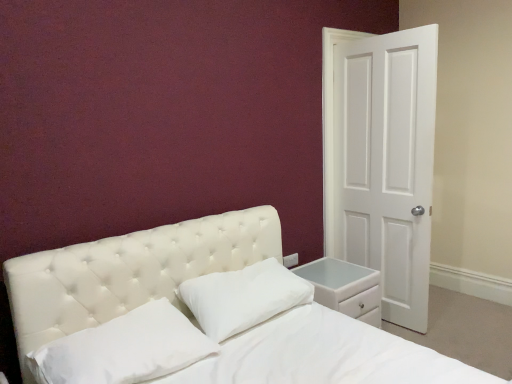
Question: Would you say white soft pillow at center, which is the 2th pillow from left to right, is to the left or to the right of white matte door at right in the picture?

Choices:
 (A) right
 (B) left

Answer: (B)

Question: Is white soft pillow at center, which is the 2th pillow from left to right, inside or outside of white matte door at right?

Choices:
 (A) outside
 (B) inside

Answer: (A)

Question: Which of these objects is positioned farthest from the white soft pillow at center, the 1th pillow positioned from the right?

Choices:
 (A) white leather nightstand at lower right
 (B) white matte door at right
 (C) white soft pillow at center, which appears as the first pillow when viewed from the left

Answer: (B)

Question: Which of these objects is positioned closest to the white soft pillow at center, the 1th pillow positioned from the right?

Choices:
 (A) white leather nightstand at lower right
 (B) white matte door at right
 (C) white soft pillow at center, the second pillow in the right-to-left sequence

Answer: (C)